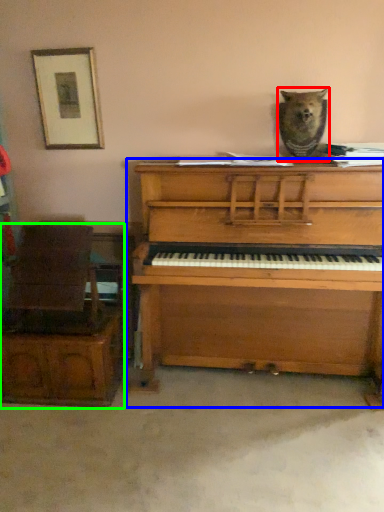
Question: Estimate the real-world distances between objects in this image. Which object is farther from animal (highlighted by a red box), piano (highlighted by a blue box) or furniture (highlighted by a green box)?

Choices:
 (A) piano
 (B) furniture

Answer: (B)